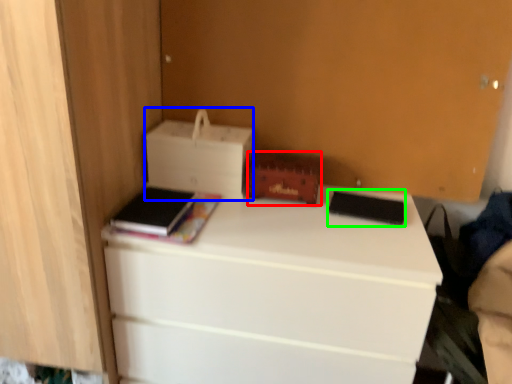
Question: Based on their relative distances, which object is farther from storage box (highlighted by a red box)? Choose from printer (highlighted by a blue box) and paperback book (highlighted by a green box).

Choices:
 (A) printer
 (B) paperback book

Answer: (B)